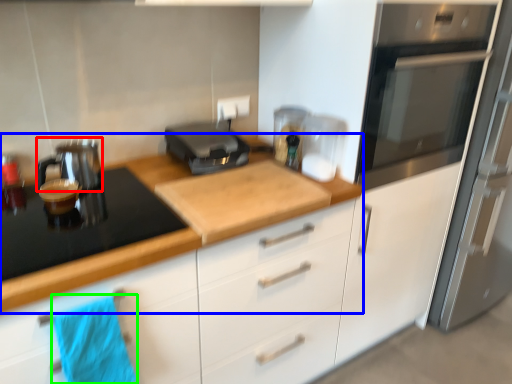
Question: Which is nearer to the kitchen appliance (highlighted by a red box)? countertop (highlighted by a blue box) or beach towel (highlighted by a green box).

Choices:
 (A) countertop
 (B) beach towel

Answer: (A)